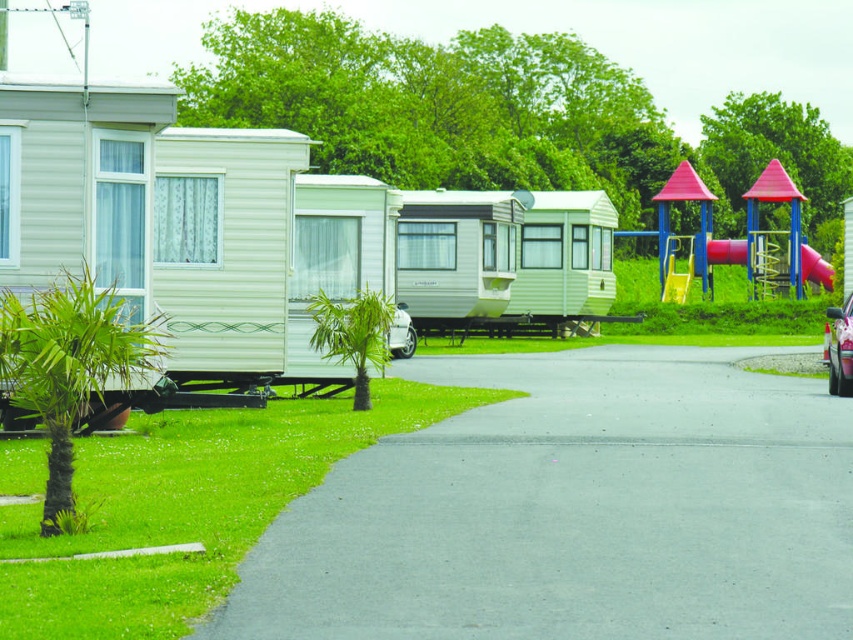
How distant is asphalt at center from shiny metallic car at center?

They are 23.11 feet apart.

Describe the element at coordinates (573, 509) in the screenshot. This screenshot has width=853, height=640. I see `asphalt at center` at that location.

Is point (280, 589) more distant than point (827, 381)?

No, (280, 589) is closer to viewer.

The image size is (853, 640). I want to click on asphalt at center, so click(573, 509).